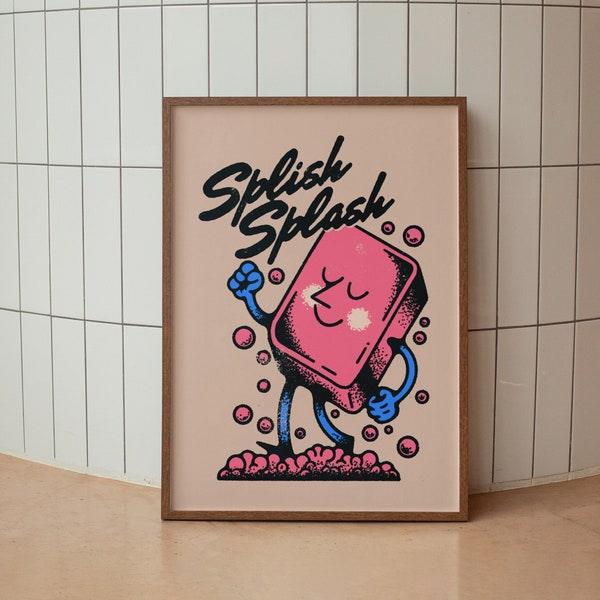
Identify the location of art. (389, 147).